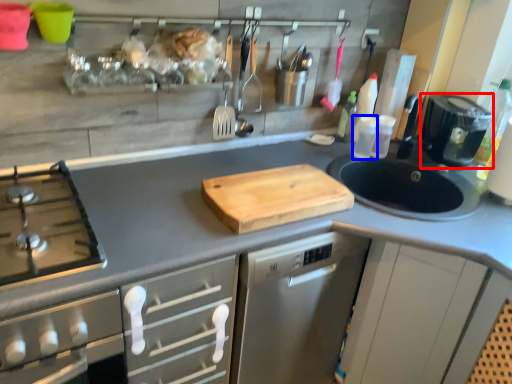
Question: Which of the following is the farthest to the observer, kitchen appliance (highlighted by a red box) or bottle (highlighted by a blue box)?

Choices:
 (A) kitchen appliance
 (B) bottle

Answer: (B)